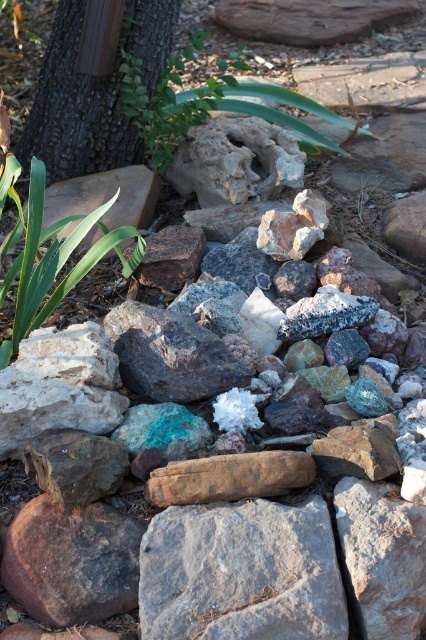
Question: Is brown rough rock at center above green leafy plant at lower left?

Choices:
 (A) no
 (B) yes

Answer: (A)

Question: Is gray rough rock at center wider than brown rough rock at center?

Choices:
 (A) yes
 (B) no

Answer: (A)

Question: Does gray rough rock at center appear on the left side of brown wood at upper left?

Choices:
 (A) yes
 (B) no

Answer: (B)

Question: Which object is closer to the camera taking this photo?

Choices:
 (A) green leafy plant at lower left
 (B) gray rough rock at center

Answer: (B)

Question: Which point is farther to the camera?

Choices:
 (A) green leafy plant at lower left
 (B) brown wood at upper left
 (C) green leafy plant at upper center

Answer: (C)

Question: Which object appears farthest from the camera in this image?

Choices:
 (A) gray rough rock at center
 (B) brown rough rock at center
 (C) brown wood at upper left

Answer: (C)